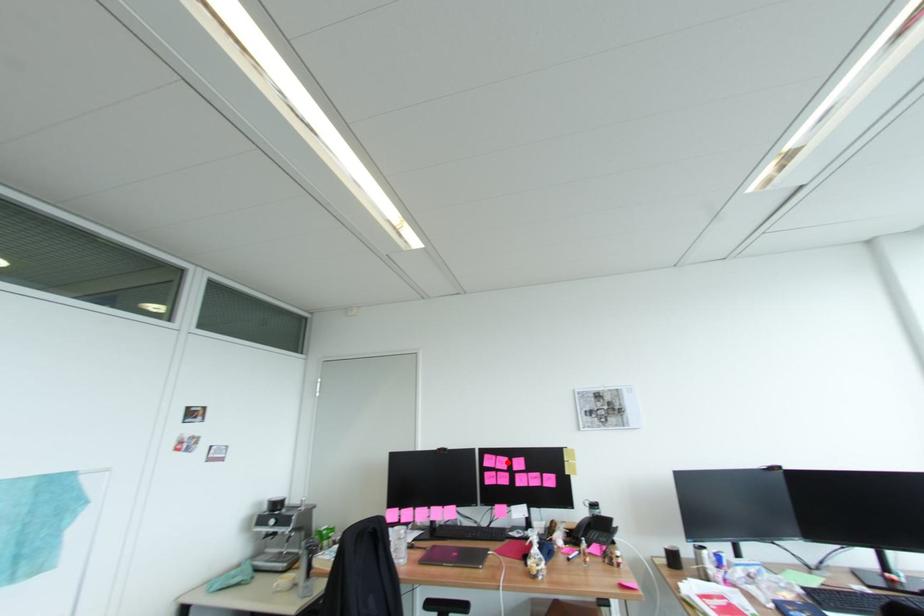
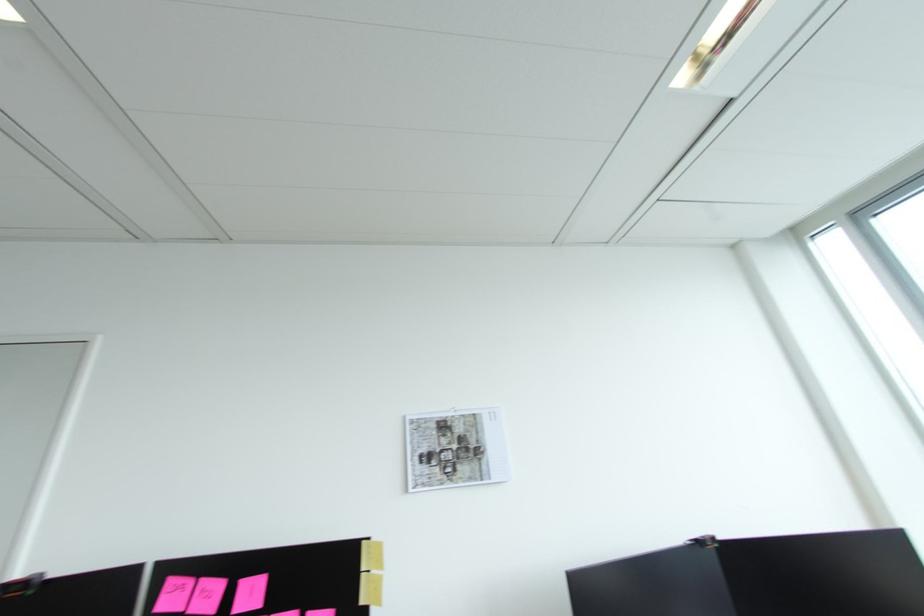
Question: I am providing you with two images of the same scene from different viewpoints. Given a red point in image1, look at the same physical point in image2. Is it:

Choices:
 (A) Closer to the viewpoint
 (B) Farther from the viewpoint

Answer: (A)